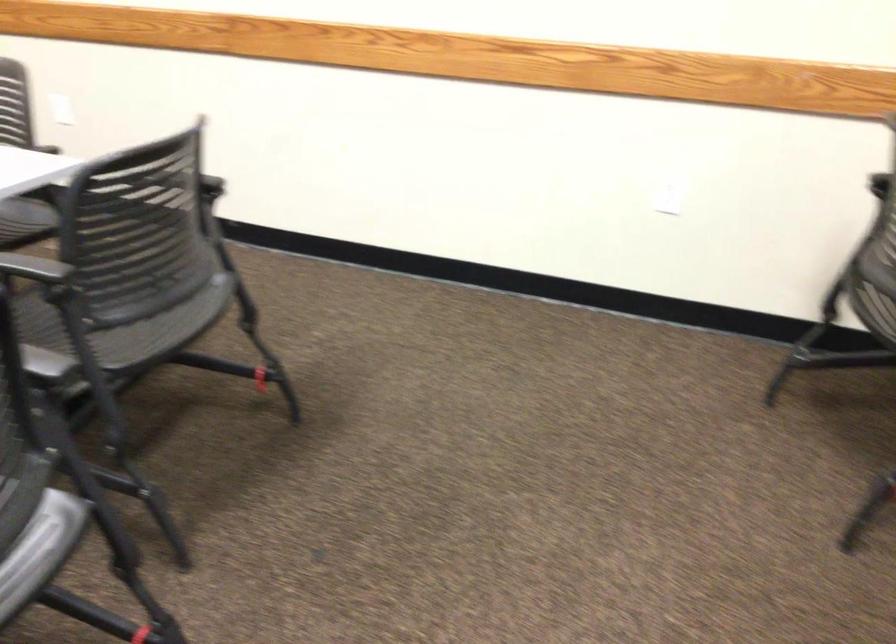
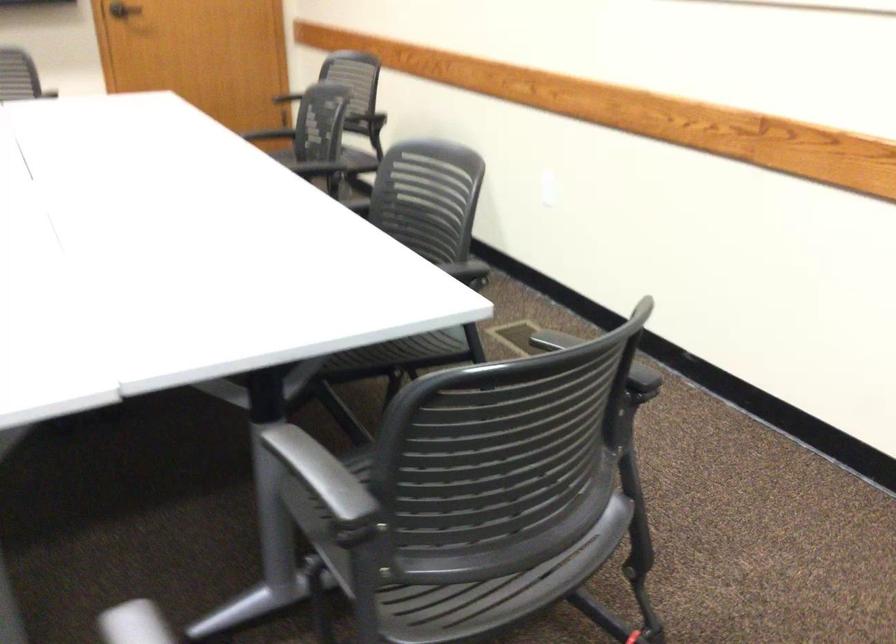
Locate, in the second image, the point that corresponds to (202,149) in the first image.

(598, 359)